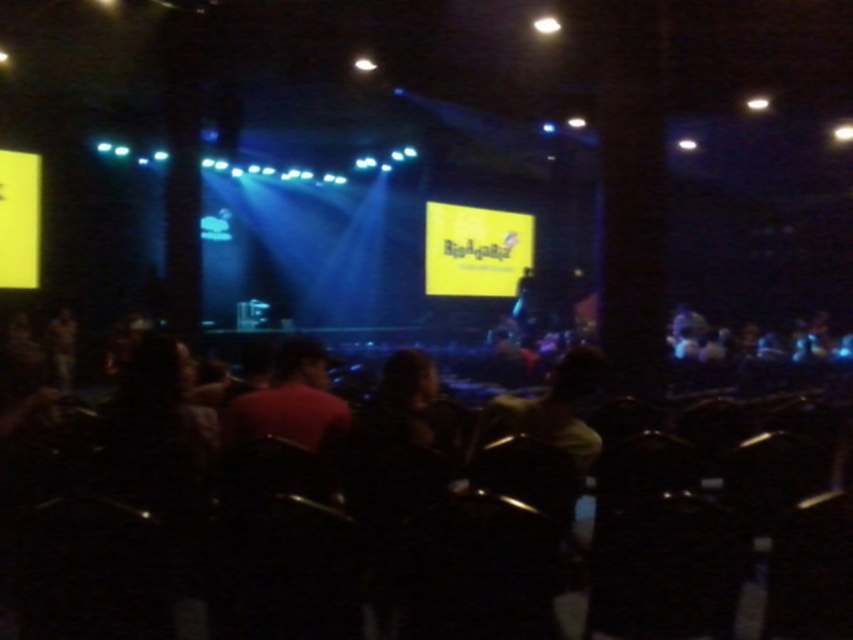
You are an event organizer who needs to adjust the seating arrangement. The black plastic chairs at lower center are currently positioned where in relation to the yellow matte screen at center? Please describe their spatial relationship.

The black plastic chairs at lower center are positioned below the yellow matte screen at center.

You are standing at the entrance of the conference hall and see the black plastic chairs at lower center. If you want to walk directly towards them, which direction should you head?

Since the black plastic chairs at lower center are located at point 0.808 on the x axis and 0.490 on the y axis, you should head towards the lower center direction to reach them.

You need to set up a large banner that requires 3 meters of space. You have two options on stage, either between the black plastic chairs at lower center or next to the yellow matte screen at center. Based on their sizes, which location would be more suitable?

The black plastic chairs at lower center are wider than the yellow matte screen at center. Therefore, the space between the black plastic chairs at lower center would provide more than 3 meters of space, making it the better option for setting up the large banner.